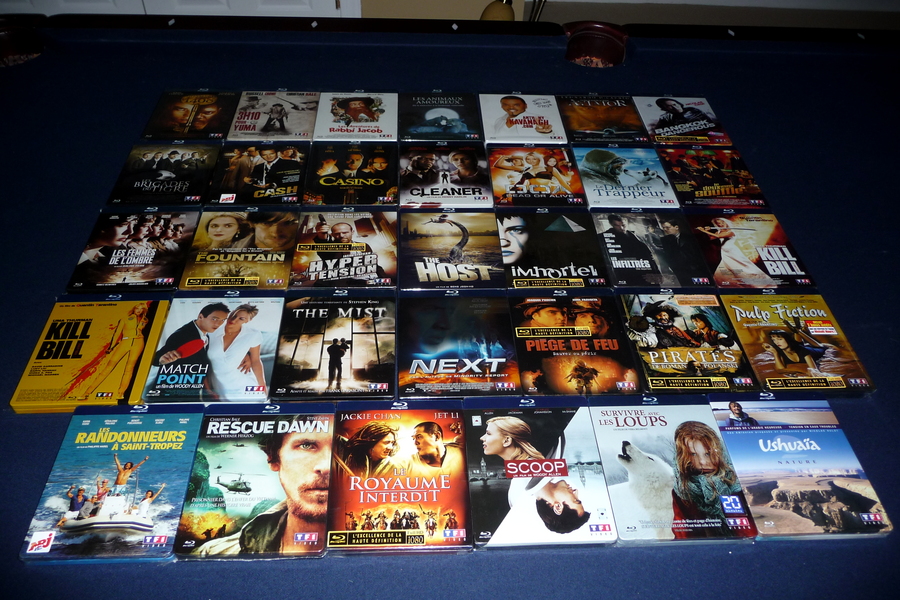
Image resolution: width=900 pixels, height=600 pixels. Find the location of `movie cases in middle row`. movie cases in middle row is located at coordinates (136, 256), (274, 262), (337, 253), (450, 265), (558, 265), (640, 268), (763, 262).